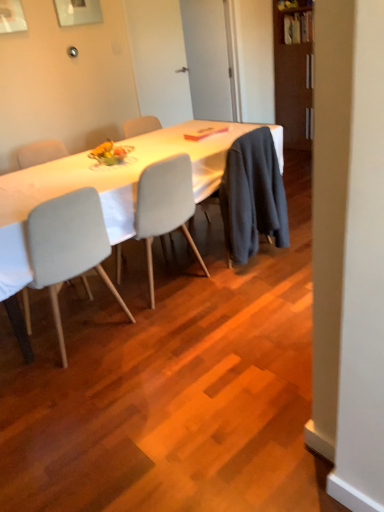
You are a GUI agent. You are given a task and a screenshot of the screen. Output one action in this format:
    pyautogui.click(x=<x>, y=<y>)
    Task: Click on the free spot to the right of light gray fabric chair at center, which ranks as the 2th chair in right-to-left order
    Image resolution: width=384 pixels, height=512 pixels.
    Given the screenshot: What is the action you would take?
    pyautogui.click(x=168, y=334)